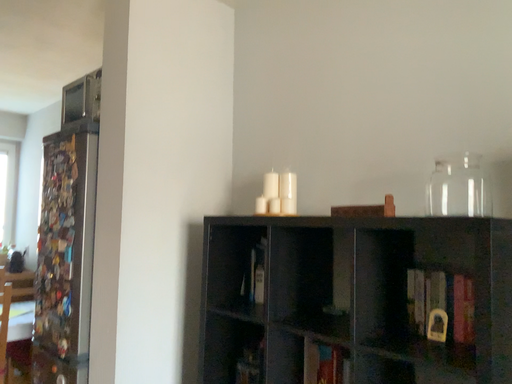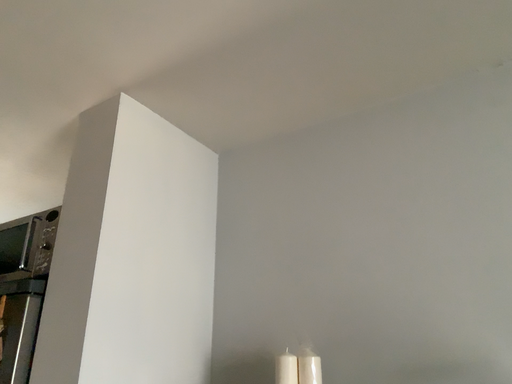
Question: How did the camera likely rotate when shooting the video?

Choices:
 (A) rotated left
 (B) rotated right

Answer: (B)